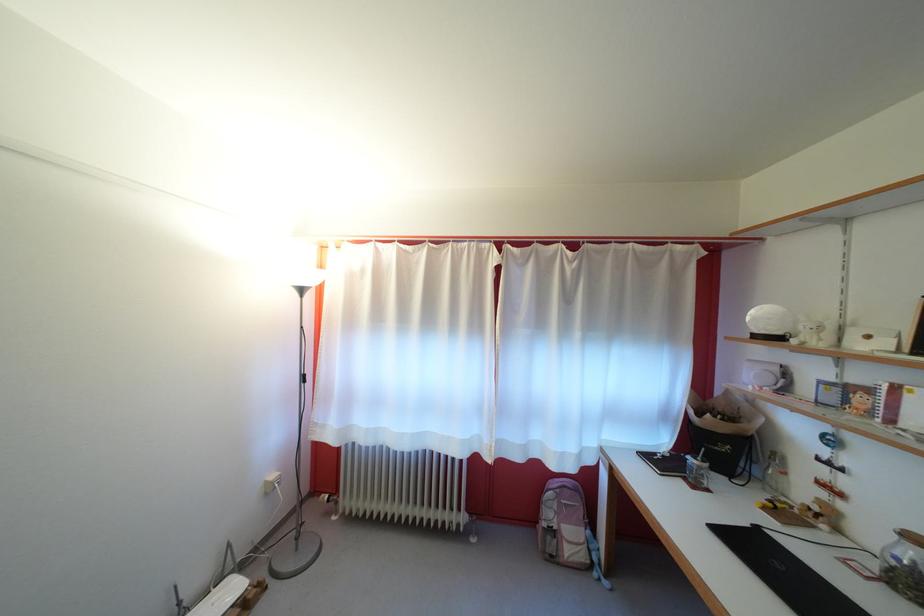
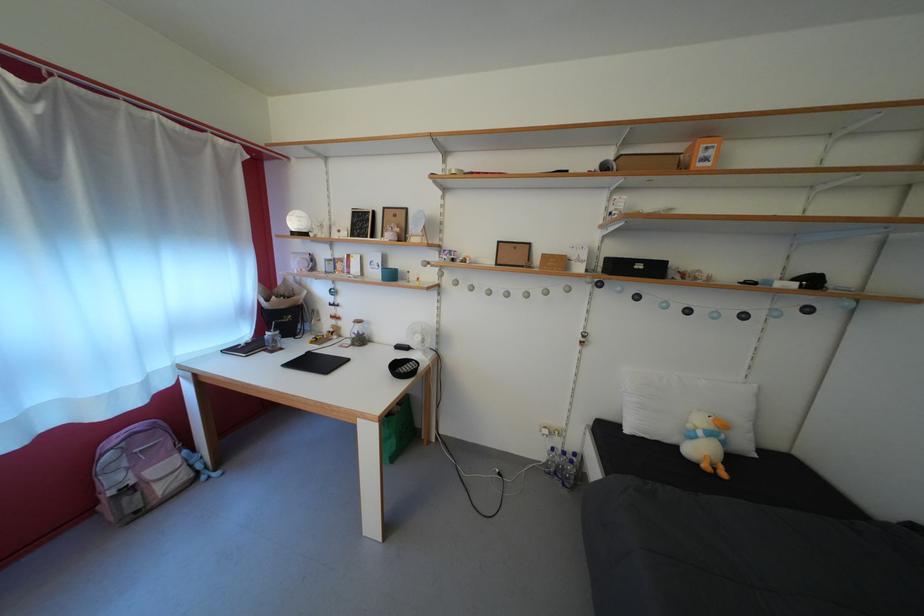
The point at (556, 521) is marked in the first image. Where is the corresponding point in the second image?

(123, 485)